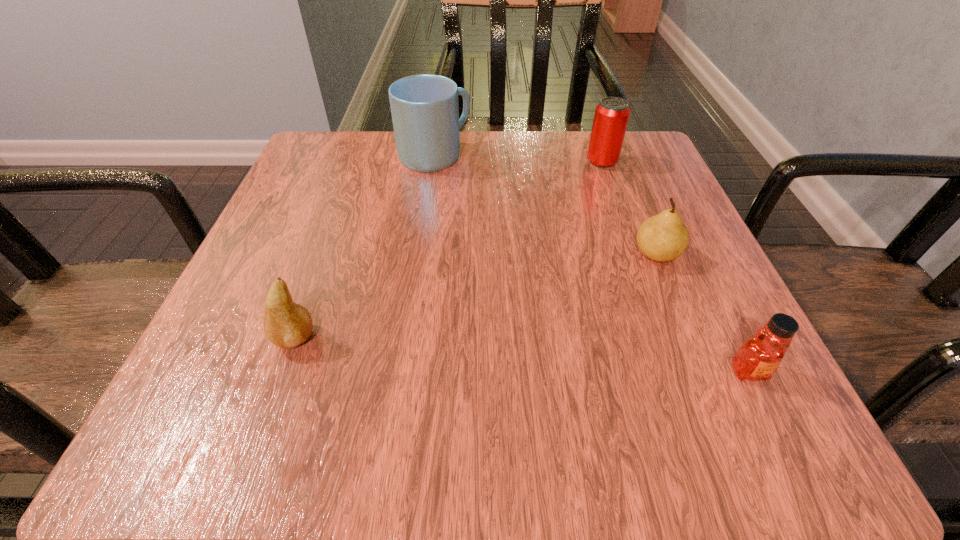
At what (x,y) coordinates should I click in order to perform the action: click on the second object from left to right. Please return your answer as a coordinate pair (x, y). Looking at the image, I should click on click(425, 111).

You are a GUI agent. You are given a task and a screenshot of the screen. Output one action in this format:
    pyautogui.click(x=<x>, y=<y>)
    Task: Click on the can
    Image resolution: width=960 pixels, height=540 pixels.
    Given the screenshot: What is the action you would take?
    pyautogui.click(x=611, y=117)

Identify the location of the third nearest object. Image resolution: width=960 pixels, height=540 pixels. (664, 237).

You are a GUI agent. You are given a task and a screenshot of the screen. Output one action in this format:
    pyautogui.click(x=<x>, y=<y>)
    Task: Click on the right pear
    This screenshot has height=540, width=960.
    Given the screenshot: What is the action you would take?
    pyautogui.click(x=664, y=237)

You are a GUI agent. You are given a task and a screenshot of the screen. Output one action in this format:
    pyautogui.click(x=<x>, y=<y>)
    Task: Click on the nearer pear
    The image size is (960, 540).
    Given the screenshot: What is the action you would take?
    pyautogui.click(x=286, y=324)

The height and width of the screenshot is (540, 960). Find the location of `the second nearest object`. the second nearest object is located at coordinates (286, 324).

You are a GUI agent. You are given a task and a screenshot of the screen. Output one action in this format:
    pyautogui.click(x=<x>, y=<y>)
    Task: Click on the honey
    The width and height of the screenshot is (960, 540).
    Given the screenshot: What is the action you would take?
    pyautogui.click(x=759, y=356)

Identify the location of free location located on the front of the mug. (417, 285).

The image size is (960, 540). I want to click on vacant point located 0.160m on the left of the can, so click(x=509, y=162).

This screenshot has height=540, width=960. What are the coordinates of `blank space located on the left of the farther pear` in the screenshot? It's located at (540, 254).